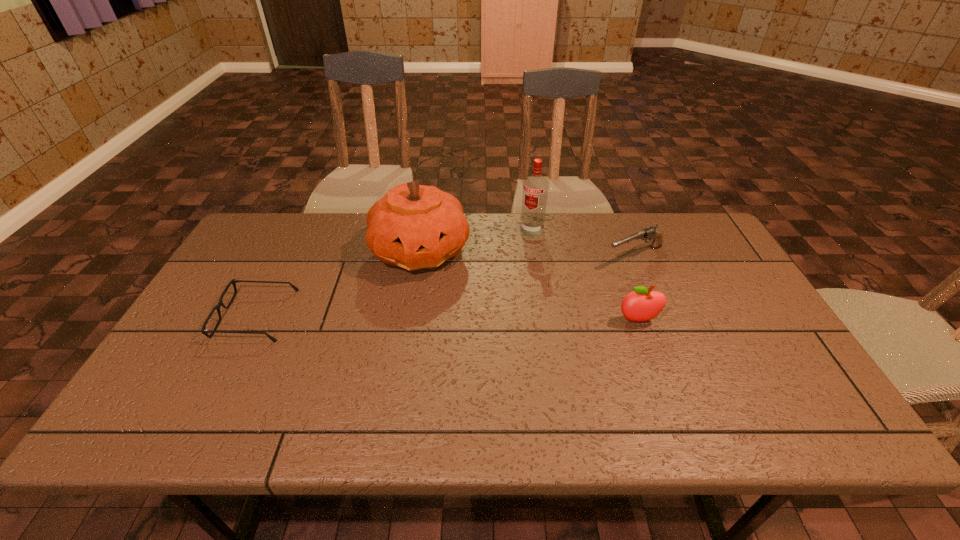
This screenshot has height=540, width=960. Find the location of `vacant region located 0.400m aiming along the barrel of the fourth tallest object`. vacant region located 0.400m aiming along the barrel of the fourth tallest object is located at coordinates (498, 312).

Identify the location of free space located 0.240m on the front-facing side of the fourth object from right to left. The height and width of the screenshot is (540, 960). (484, 334).

Find the location of `free space located 0.240m on the front-facing side of the fourth object from right to left`. free space located 0.240m on the front-facing side of the fourth object from right to left is located at coordinates (484, 334).

The width and height of the screenshot is (960, 540). Identify the location of vacant space located 0.270m on the front-facing side of the fourth object from right to left. [490, 342].

At what (x,y) coordinates should I click in order to perform the action: click on vacant area located 0.100m on the front label of the third object from left to right. Please return your answer as a coordinate pair (x, y). Looking at the image, I should click on (516, 254).

Where is `vacant position located on the front label of the third object from left to right`? The width and height of the screenshot is (960, 540). vacant position located on the front label of the third object from left to right is located at coordinates (486, 299).

This screenshot has height=540, width=960. I want to click on vacant space located 0.120m on the front label of the third object from left to right, so click(x=514, y=258).

Where is `gun located in the far edge section of the desktop`? This screenshot has width=960, height=540. gun located in the far edge section of the desktop is located at coordinates (650, 233).

At what (x,y) coordinates should I click in order to perform the action: click on pumpkin that is at the far edge. Please return your answer as a coordinate pair (x, y). Looking at the image, I should click on (413, 226).

Find the location of a particular element. vodka that is positioned at the far edge is located at coordinates (535, 187).